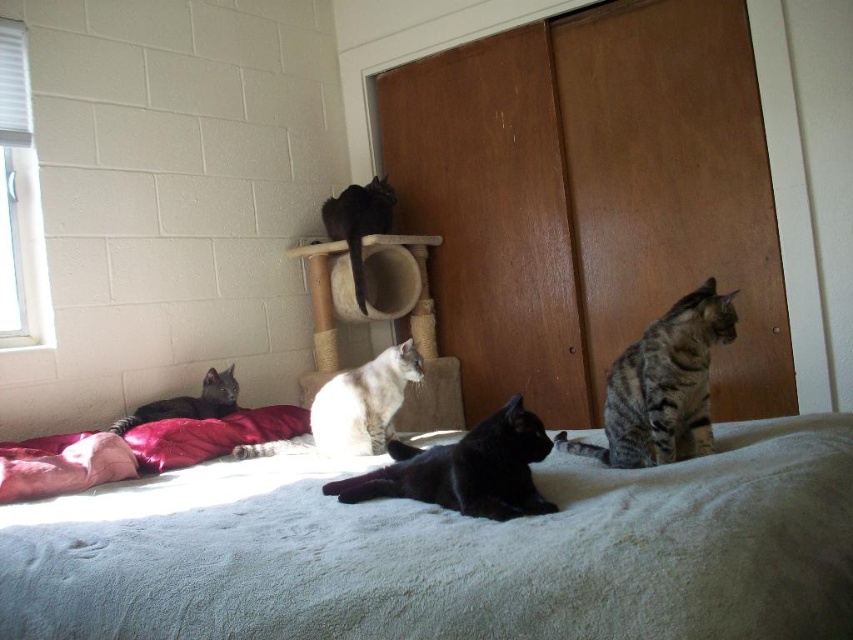
Does silky black cat at center appear over shiny black cat at lower left?

Indeed, silky black cat at center is positioned over shiny black cat at lower left.

Can you confirm if silky black cat at center is taller than shiny black cat at lower left?

Correct, silky black cat at center is much taller as shiny black cat at lower left.

Which is behind, point (335, 236) or point (137, 422)?

Point (335, 236)

The height and width of the screenshot is (640, 853). In order to click on silky black cat at center in this screenshot , I will do `click(358, 221)`.

Which of these two, white soft bed at center or velvet red pillow at lower left, stands taller?

white soft bed at center

Who is more forward, (329, 515) or (138, 429)?

Point (329, 515)

In order to click on white soft bed at center in this screenshot , I will do `click(451, 552)`.

Between tabby fur cat at right and shiny black cat at lower left, which one has less height?

Standing shorter between the two is shiny black cat at lower left.

How far apart are tabby fur cat at right and shiny black cat at lower left?

tabby fur cat at right is 4.55 feet away from shiny black cat at lower left.

I want to click on tabby fur cat at right, so click(x=662, y=385).